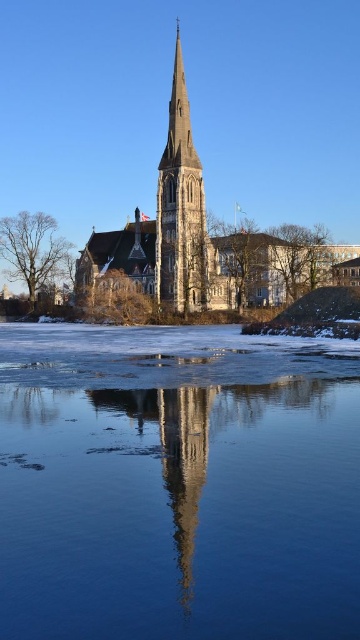
You are standing at the center of the image and want to locate the stone steeple at center. According to the coordinates provided, in which direction should you look to find it?

The stone steeple at center is located at coordinates point [203,240]. Since you are at the center, looking towards the coordinates would mean looking slightly to the left and upwards because the x coordinate is 0.375 which is less than 0.5 and the y coordinate is 0.564 which is above the center point.

You are an architect analyzing the church structure in the winter scene. You observe the stone steeple at center and the stone spire at center. Which of these two structures is located lower in the image?

The stone steeple at center is positioned under the stone spire at center, meaning it is lower in the image.

You are a photographer standing at the edge of the water in the winter scene. You want to capture a photo that includes both the transparent ice at lower center and the stone spire at center. Given that your camera can focus on objects within a 30 meter range, will you be able to include both in a single shot?

The transparent ice at lower center and stone spire at center are 35.78 meters apart from each other. Since the distance between them exceeds the camera focus range of 30 meters, you cannot capture both in a single shot.